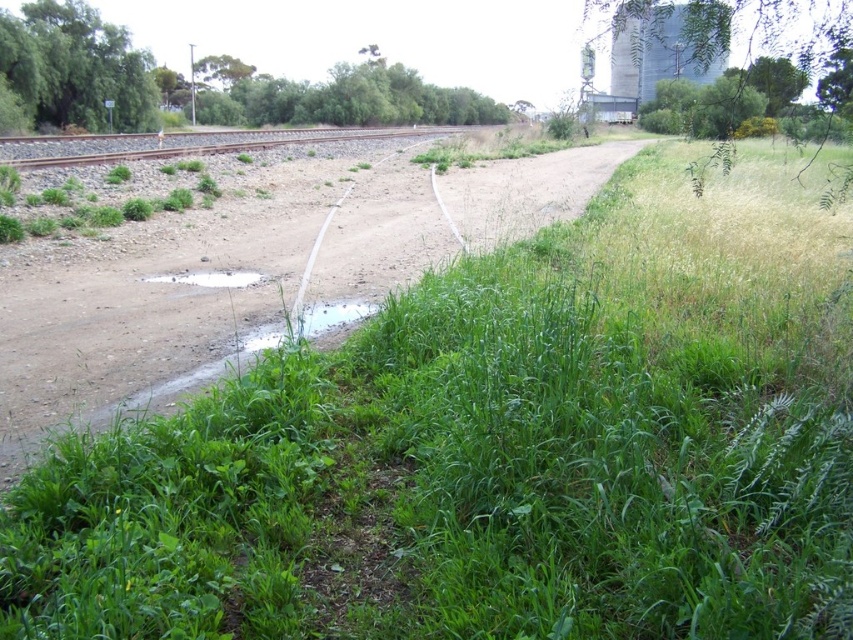
Question: Does clear water at center have a lesser width compared to white matte puddle at center?

Choices:
 (A) no
 (B) yes

Answer: (B)

Question: Is clear water at center below white matte puddle at center?

Choices:
 (A) no
 (B) yes

Answer: (B)

Question: Which of the following is the closest to the observer?

Choices:
 (A) (355, 307)
 (B) (163, 282)

Answer: (A)

Question: Which object is farther from the camera taking this photo?

Choices:
 (A) clear water at center
 (B) white matte puddle at center

Answer: (B)

Question: Which point is farther to the camera?

Choices:
 (A) (172, 282)
 (B) (367, 314)

Answer: (A)

Question: Does clear water at center have a larger size compared to white matte puddle at center?

Choices:
 (A) no
 (B) yes

Answer: (B)